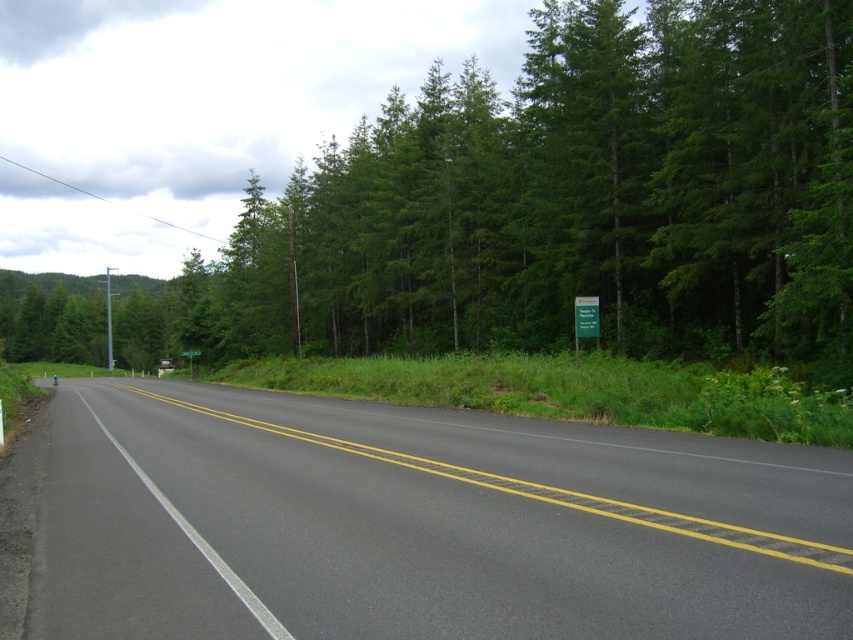
You are driving a car and see two points on the road ahead. The first point is at coordinate point(224, 536) and the second point is at point(190, 349). According to the image, which point is closer to your current position?

Point(190, 349) is closer to your current position because it is behind point(224, 536), which is further ahead on the road.

You are a driver approaching a two lane road with a green leafy tree at center and a black asphalt highway at center. Which object is bigger in the image?

The green leafy tree at center has a larger size compared to the black asphalt highway at center, so the green leafy tree at center is bigger.